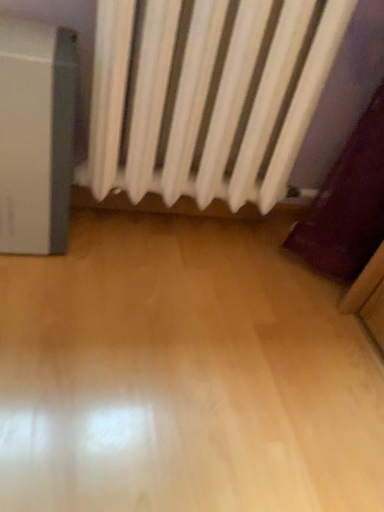
Question: From the image's perspective, does satin silver air purifier at left appear higher than white matte radiator at upper center?

Choices:
 (A) no
 (B) yes

Answer: (A)

Question: Is satin silver air purifier at left facing away from white matte radiator at upper center?

Choices:
 (A) no
 (B) yes

Answer: (A)

Question: From a real-world perspective, is satin silver air purifier at left over white matte radiator at upper center?

Choices:
 (A) no
 (B) yes

Answer: (A)

Question: Is satin silver air purifier at left completely or partially outside of white matte radiator at upper center?

Choices:
 (A) yes
 (B) no

Answer: (A)

Question: Is satin silver air purifier at left directly adjacent to white matte radiator at upper center?

Choices:
 (A) yes
 (B) no

Answer: (B)

Question: Does satin silver air purifier at left have a greater width compared to white matte radiator at upper center?

Choices:
 (A) no
 (B) yes

Answer: (B)

Question: Considering the relative sizes of white matte radiator at upper center and satin silver air purifier at left in the image provided, is white matte radiator at upper center taller than satin silver air purifier at left?

Choices:
 (A) yes
 (B) no

Answer: (A)

Question: Considering the relative sizes of white matte radiator at upper center and satin silver air purifier at left in the image provided, is white matte radiator at upper center smaller than satin silver air purifier at left?

Choices:
 (A) no
 (B) yes

Answer: (A)

Question: Is white matte radiator at upper center located outside satin silver air purifier at left?

Choices:
 (A) yes
 (B) no

Answer: (A)

Question: Is white matte radiator at upper center oriented away from satin silver air purifier at left?

Choices:
 (A) yes
 (B) no

Answer: (B)

Question: Is white matte radiator at upper center closer to the viewer compared to satin silver air purifier at left?

Choices:
 (A) yes
 (B) no

Answer: (A)

Question: Is white matte radiator at upper center beside satin silver air purifier at left?

Choices:
 (A) no
 (B) yes

Answer: (A)

Question: From their relative heights in the image, would you say satin silver air purifier at left is taller or shorter than white matte radiator at upper center?

Choices:
 (A) short
 (B) tall

Answer: (A)